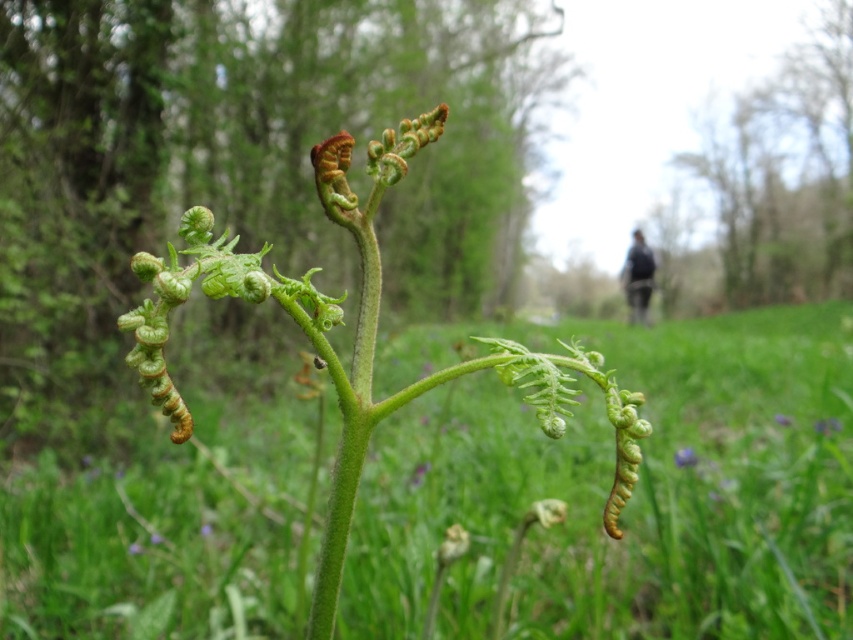
Question: Is purple matte flower at lower center closer to camera compared to purple matte flower at center?

Choices:
 (A) yes
 (B) no

Answer: (A)

Question: Does green matte fern at center appear under dark blue jacket at center?

Choices:
 (A) yes
 (B) no

Answer: (A)

Question: Based on their relative distances, which object is farther from the purple matte flower at lower center?

Choices:
 (A) dark blue jacket at center
 (B) purple matte flower at center

Answer: (A)

Question: Which of these objects is positioned closest to the dark blue jacket at center?

Choices:
 (A) purple matte flower at lower center
 (B) green matte fern at center

Answer: (A)

Question: Which of the following is the farthest from the observer?

Choices:
 (A) (566, 593)
 (B) (775, 420)

Answer: (B)

Question: Does green matte fern at center lie in front of purple matte flower at lower center?

Choices:
 (A) no
 (B) yes

Answer: (B)